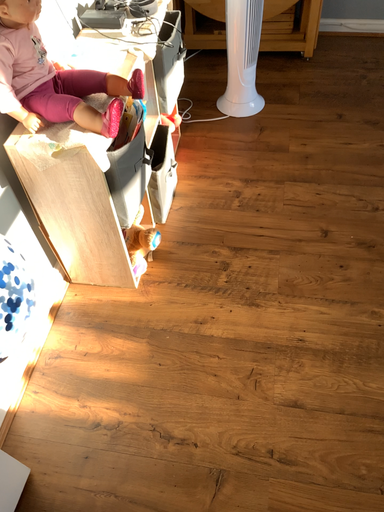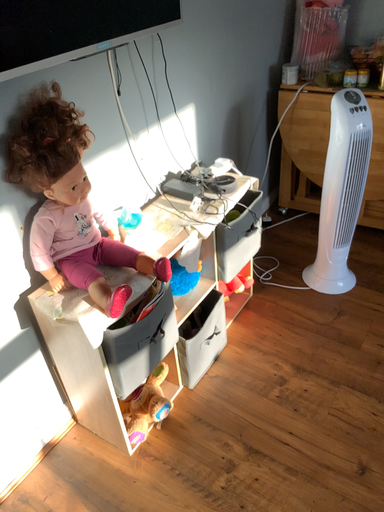
Question: Which way did the camera rotate in the video?

Choices:
 (A) rotated right
 (B) rotated left

Answer: (B)